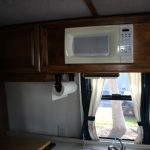
Find the location of a particular element. microwave is located at coordinates (100, 40).